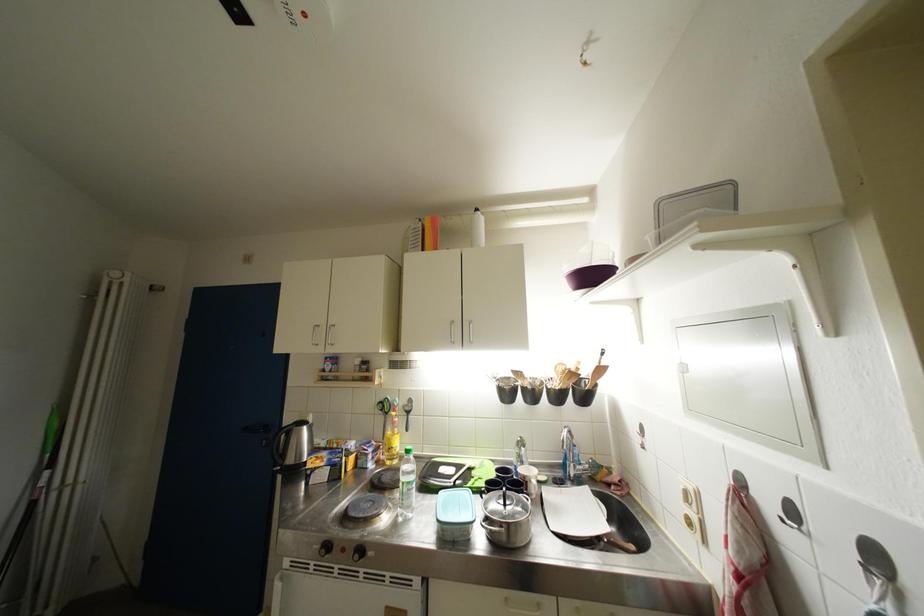
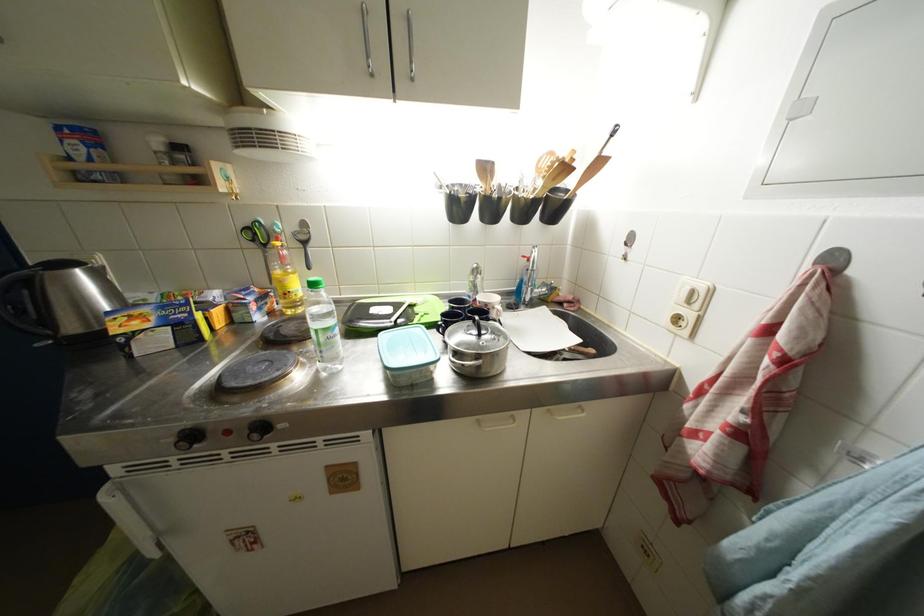
Where in the second image is the point corresponding to pixel 324 551 from the first image?

(178, 444)